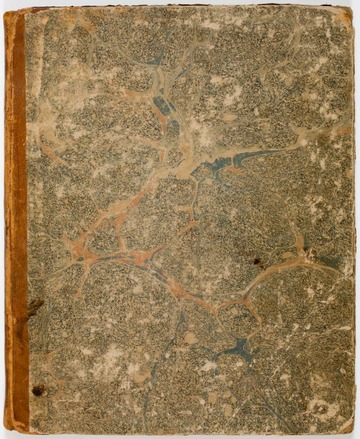
I want to click on book of some sort, so click(213, 246).